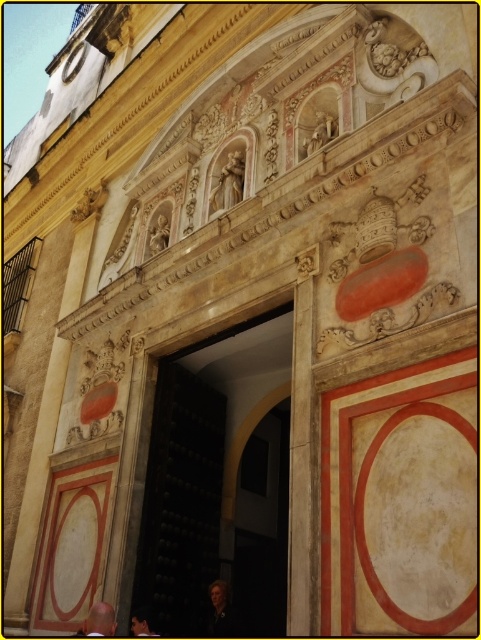
Question: Can you confirm if light brown leather jacket at center is positioned to the left of dark brown leather jacket at lower left?

Choices:
 (A) no
 (B) yes

Answer: (B)

Question: Which point is farther to the camera?

Choices:
 (A) dark brown leather jacket at lower left
 (B) dark wood door at center

Answer: (B)

Question: Considering the real-world distances, which object is closest to the light brown leather jacket at center?

Choices:
 (A) dark brown leather jacket at lower left
 (B) dark wood door at center

Answer: (A)

Question: Observing the image, what is the correct spatial positioning of dark wood door at center in reference to light brown leather jacket at center?

Choices:
 (A) below
 (B) above

Answer: (B)

Question: Is light brown leather jacket at center to the right of dark brown leather jacket at lower left from the viewer's perspective?

Choices:
 (A) yes
 (B) no

Answer: (B)

Question: Which point is closer to the camera taking this photo?

Choices:
 (A) (144, 616)
 (B) (95, 604)

Answer: (A)